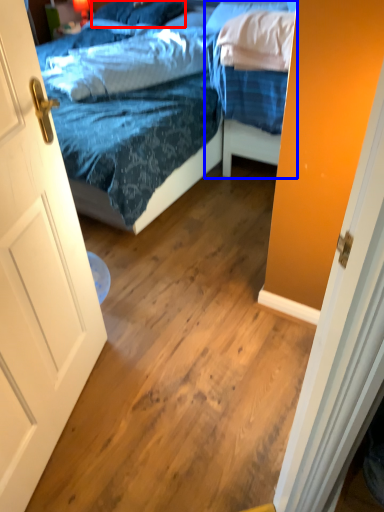
Question: Which object appears farthest to the camera in this image, pillow (highlighted by a red box) or bed (highlighted by a blue box)?

Choices:
 (A) pillow
 (B) bed

Answer: (A)